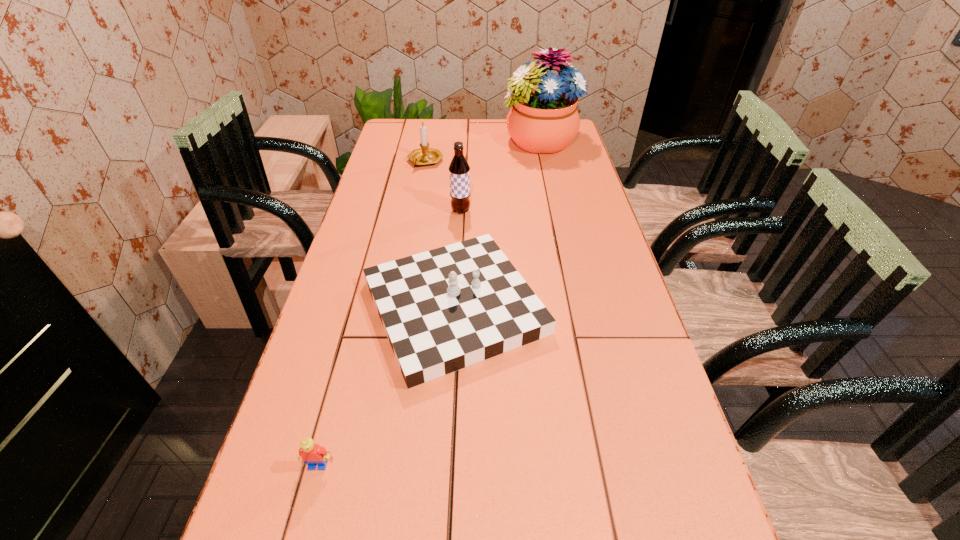
Identify the location of free region at the left edge. The height and width of the screenshot is (540, 960). (393, 197).

In the image, there is a desktop. In order to click on vacant area at the right edge in this screenshot , I will do `click(578, 160)`.

At what (x,y) coordinates should I click in order to perform the action: click on vacant region at the far left corner of the desktop. Please return your answer as a coordinate pair (x, y). The width and height of the screenshot is (960, 540). Looking at the image, I should click on (400, 131).

I want to click on empty space between the tallest object and the candle holder, so click(483, 152).

You are a GUI agent. You are given a task and a screenshot of the screen. Output one action in this format:
    pyautogui.click(x=<x>, y=<y>)
    Task: Click on the unoccupied position between the third shortest object and the third farthest object
    
    Given the screenshot: What is the action you would take?
    pyautogui.click(x=444, y=186)

Identify the location of vacant space that's between the shortest object and the checkerboard. The height and width of the screenshot is (540, 960). (386, 386).

Where is `empty location between the checkerboard and the third tallest object`? The image size is (960, 540). empty location between the checkerboard and the third tallest object is located at coordinates (440, 234).

Where is `unoccupied position between the fourth tallest object and the tallest object`? unoccupied position between the fourth tallest object and the tallest object is located at coordinates (497, 225).

Find the location of a particular element. This screenshot has height=540, width=960. empty location between the root beer and the tallest object is located at coordinates (500, 177).

Find the location of a particular element. Image resolution: width=960 pixels, height=540 pixels. the closest object to the candle holder is located at coordinates (543, 119).